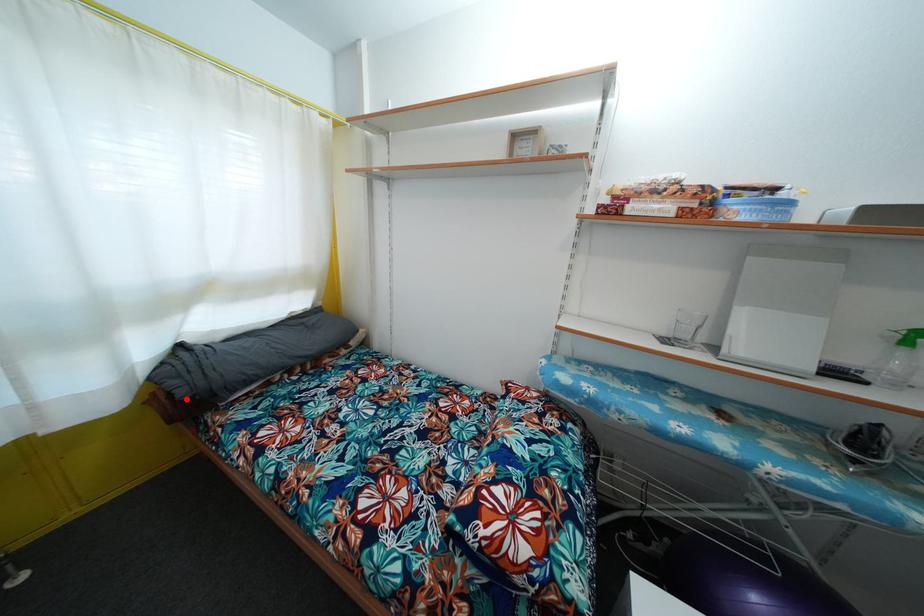
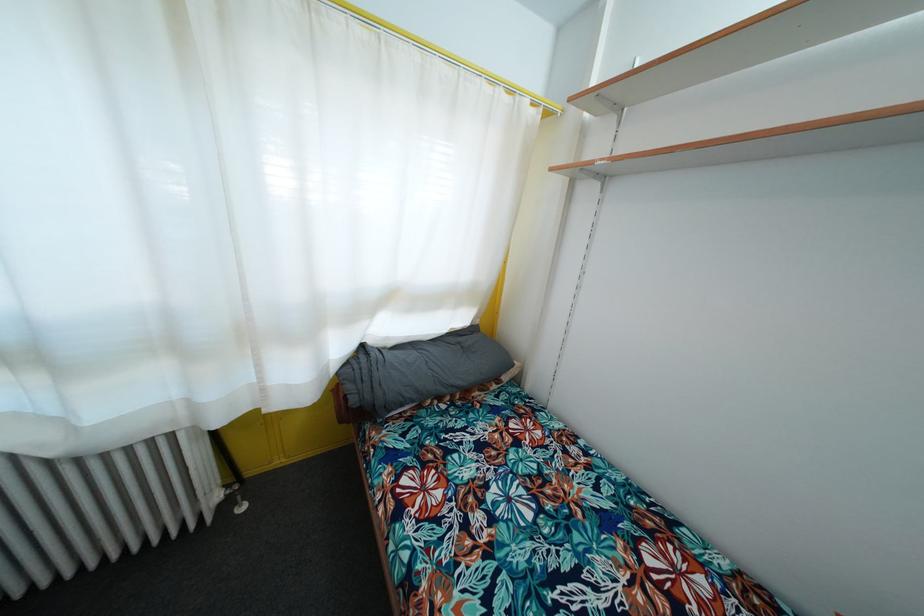
Question: A red point is marked in image1. In image2, is the corresponding 3D point closer to the camera or farther? Reply with the corresponding letter.

Choices:
 (A) The corresponding 3D point is closer.
 (B) The corresponding 3D point is farther.

Answer: (B)